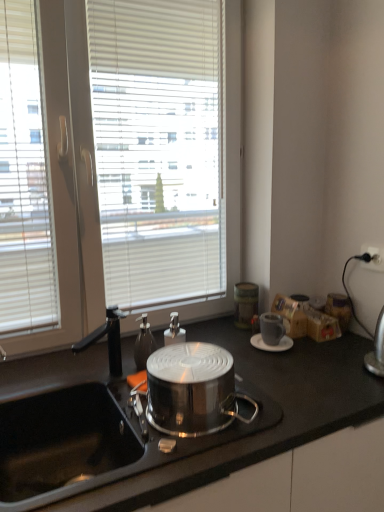
Find the location of a particular element. This screenshot has height=512, width=384. space that is in front of white matte saucer at right is located at coordinates (283, 367).